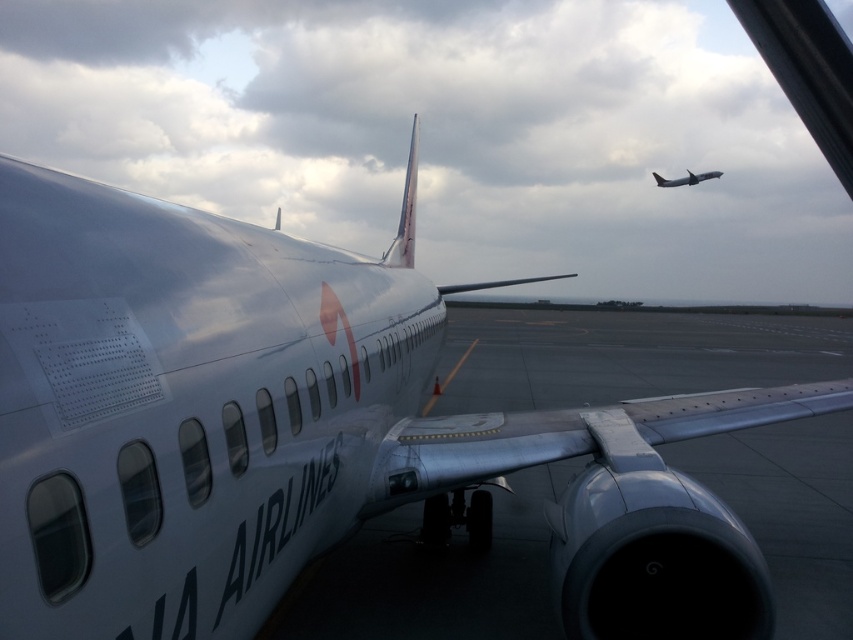
You are an airport maintenance worker who needs to inspect both the metallic silver wing at center and the silver metallic airplane at upper right. Based on their heights, which object should you prioritize inspecting first if you have a ladder that can reach up to 10 meters?

The metallic silver wing at center has a lesser height compared to the silver metallic airplane at upper right. Since the ladder can reach up to 10 meters, you should prioritize inspecting the silver metallic airplane at upper right first because it is taller and may require immediate attention before the ladder becomes unavailable.

You are an airport security officer monitoring the runway. You notice two objects in the image, the metallic silver wing at center and the silver metallic airplane at upper right. Which object is closer to you?

The metallic silver wing at center is closer to you because it has a smaller size compared to the silver metallic airplane at upper right, indicating it is nearer.

What is the exact coordinate of the metallic silver wing at center?

The metallic silver wing at center is located at point (576, 435).